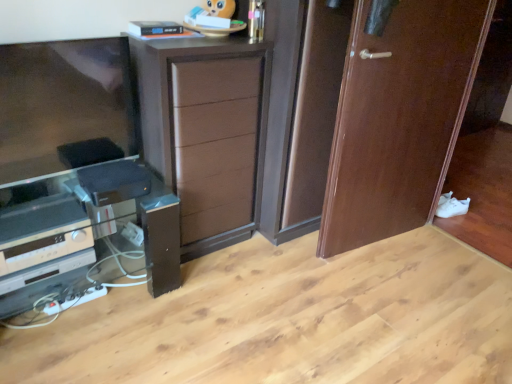
Where is `spots to the right of brown wood chest of drawers at center`? The width and height of the screenshot is (512, 384). spots to the right of brown wood chest of drawers at center is located at coordinates (272, 267).